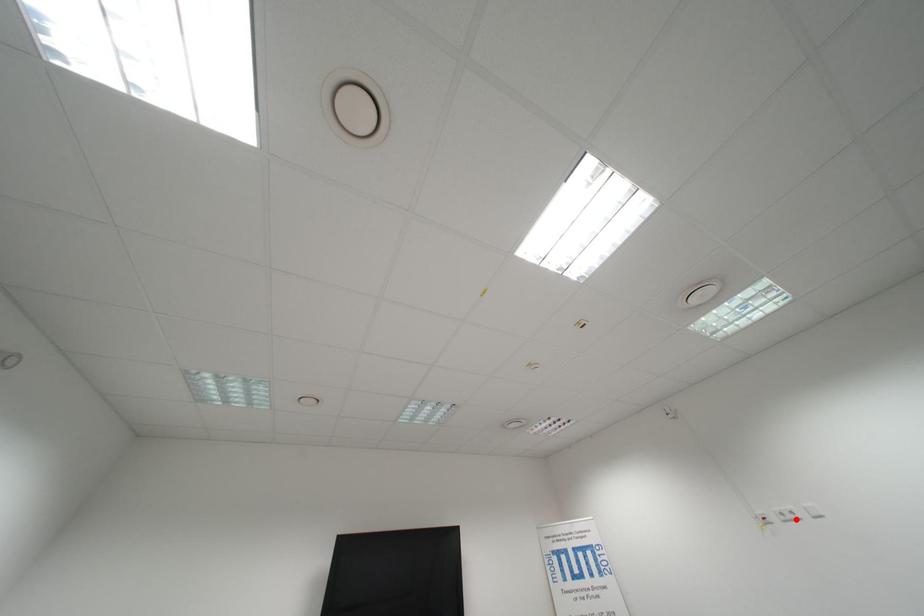
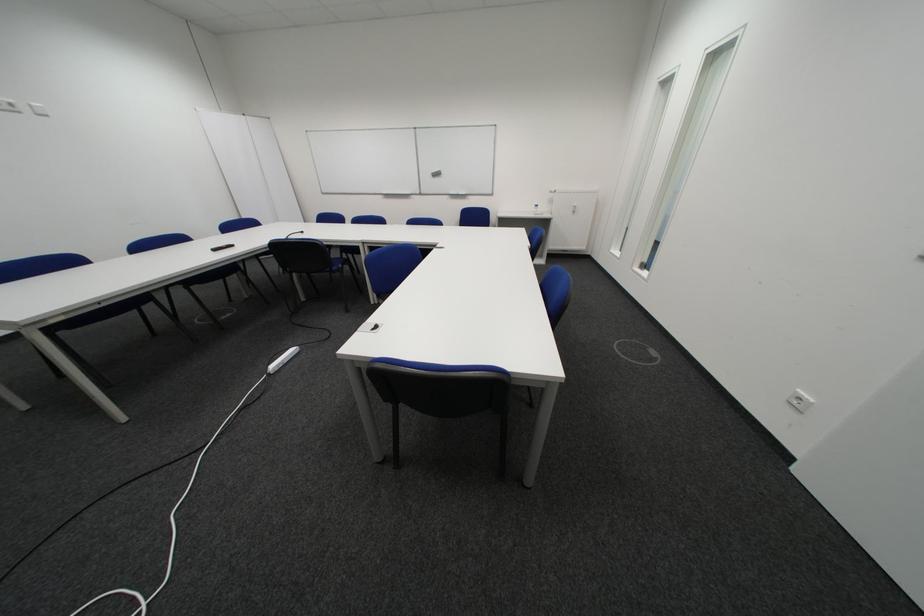
In the second image, find the point that corresponds to the highlighted location in the first image.

(8, 108)